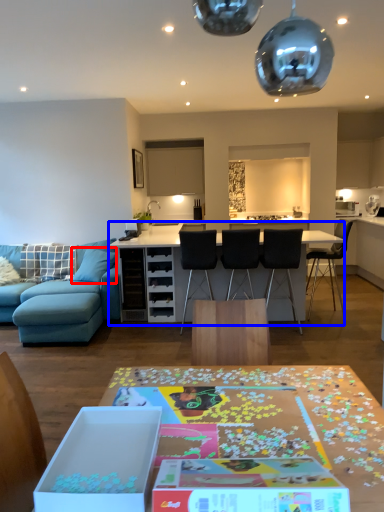
Question: Which point is closer to the camera, pillow (highlighted by a red box) or table (highlighted by a blue box)?

Choices:
 (A) pillow
 (B) table

Answer: (B)